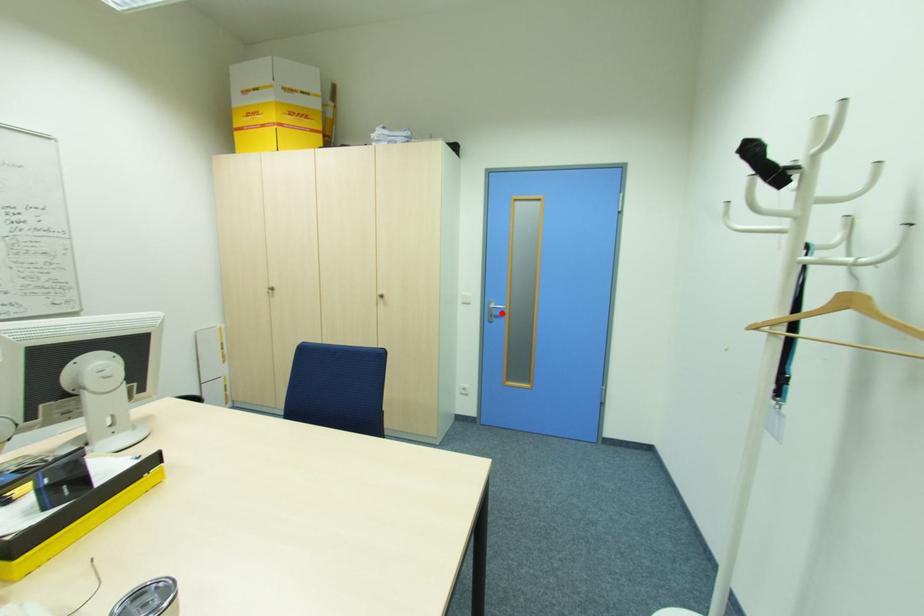
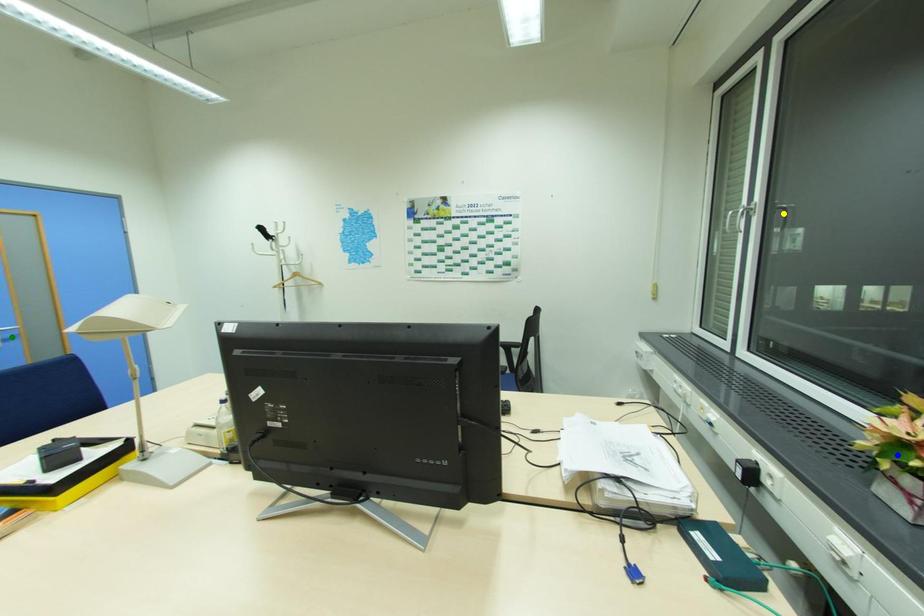
Question: I am providing you with two images of the same scene from different viewpoints. A red point is marked on the first image. You are given multiple points on the second image. Which spot in image 2 lines up with the point in image 1?

Choices:
 (A) blue point
 (B) yellow point
 (C) green point

Answer: (C)